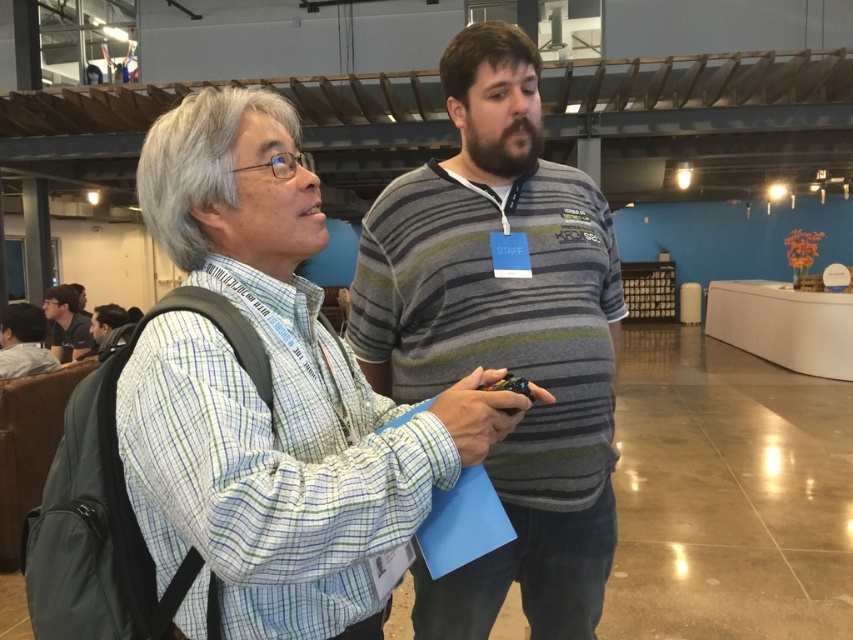
Question: Which of the following is the closest to the observer?

Choices:
 (A) (6, 372)
 (B) (480, 273)
 (C) (273, 570)

Answer: (C)

Question: Does plaid shirt at center appear on the left side of striped cotton shirt at center?

Choices:
 (A) no
 (B) yes

Answer: (B)

Question: Among these points, which one is nearest to the camera?

Choices:
 (A) (38, 317)
 (B) (64, 353)
 (C) (345, 634)
 (D) (489, 150)

Answer: (C)

Question: Which of the following is the closest to the observer?

Choices:
 (A) striped cotton shirt at center
 (B) plaid shirt at center

Answer: (B)

Question: Is plaid shirt at center closer to the viewer compared to striped cotton shirt at center?

Choices:
 (A) no
 (B) yes

Answer: (B)

Question: Observing the image, what is the correct spatial positioning of striped cotton shirt at center in reference to matte black backpack at left?

Choices:
 (A) below
 (B) above

Answer: (A)